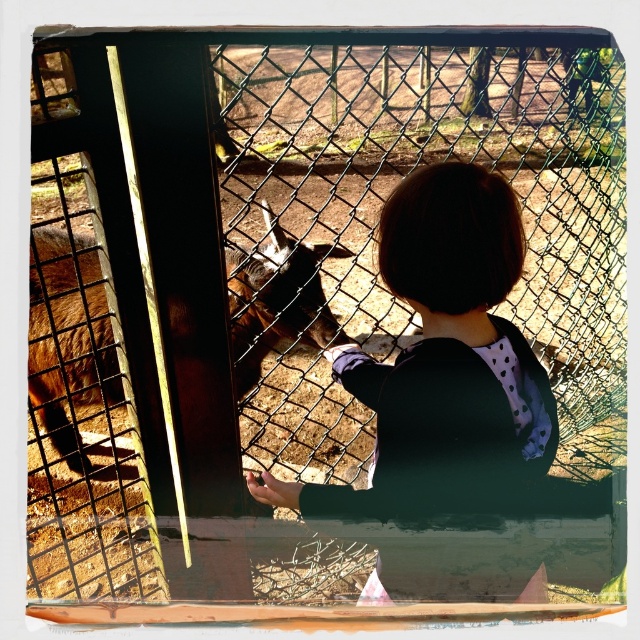
Question: Does black matte shirt at center appear on the left side of brown furry goat at left?

Choices:
 (A) yes
 (B) no

Answer: (B)

Question: Can you confirm if black matte shirt at center is positioned above brown furry goat at left?

Choices:
 (A) no
 (B) yes

Answer: (A)

Question: Does black matte shirt at center have a greater width compared to brown furry goat at left?

Choices:
 (A) no
 (B) yes

Answer: (A)

Question: Which point is farther to the camera?

Choices:
 (A) (401, 180)
 (B) (56, 288)

Answer: (B)